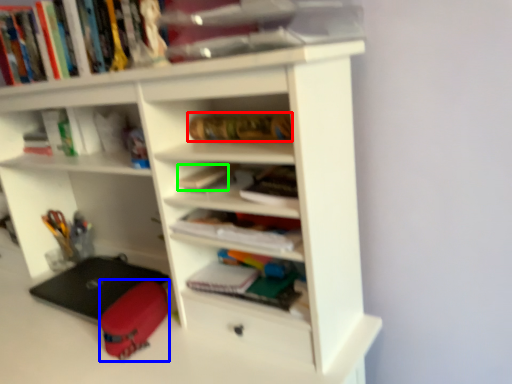
Question: Which object is positioned farthest from book (highlighted by a red box)? Select from luggage (highlighted by a blue box) and book (highlighted by a green box).

Choices:
 (A) luggage
 (B) book

Answer: (A)